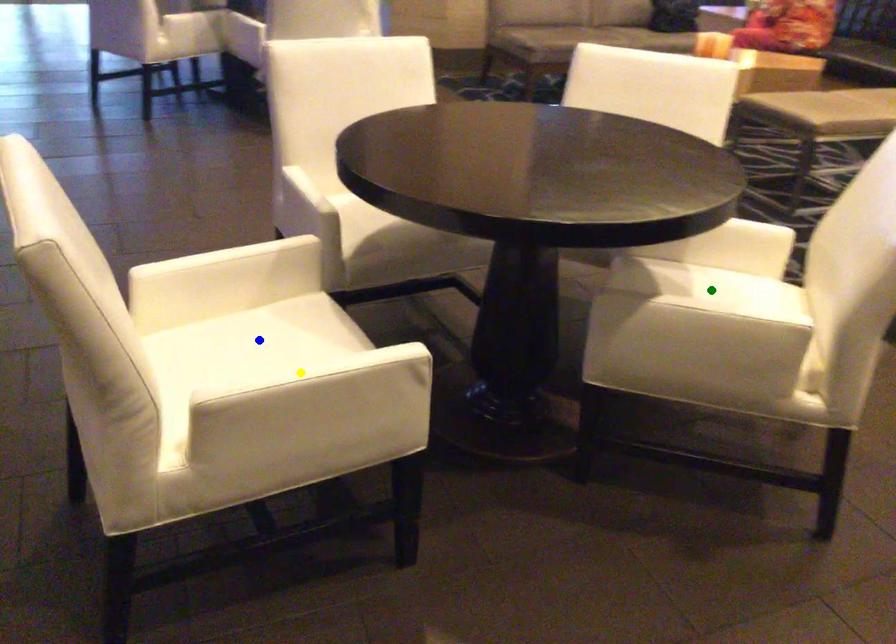
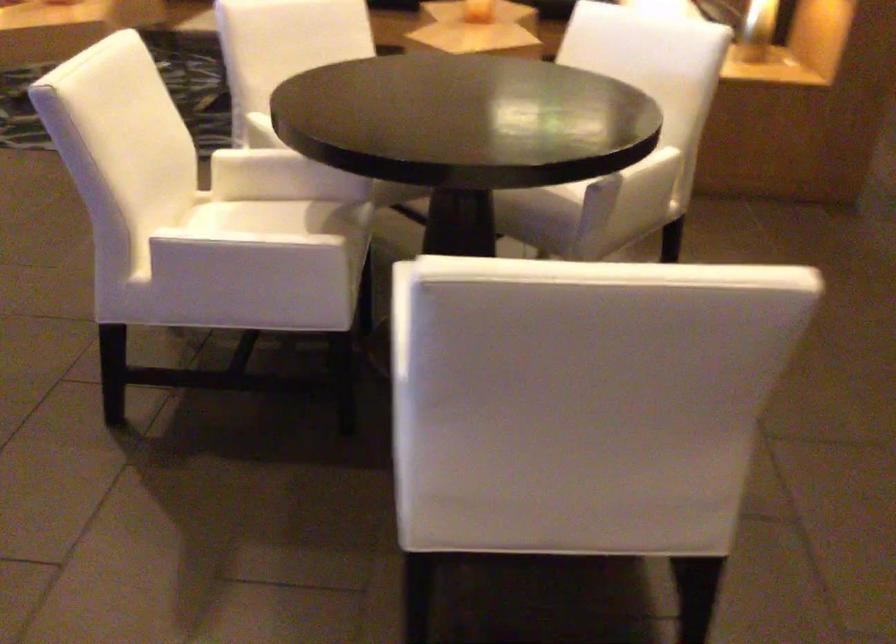
I am providing you with two images of the same scene from different viewpoints. Three points are marked in image1. Which point corresponds to a part or object that is occluded in image2?In image1, three points are marked. Which of them correspond to a part or object that is occluded in image2?Among the three points shown in image1, which one corresponds to a part or object that is no longer visible due to occlusion in image2?

Invisible in image2: green point, yellow point, blue point.